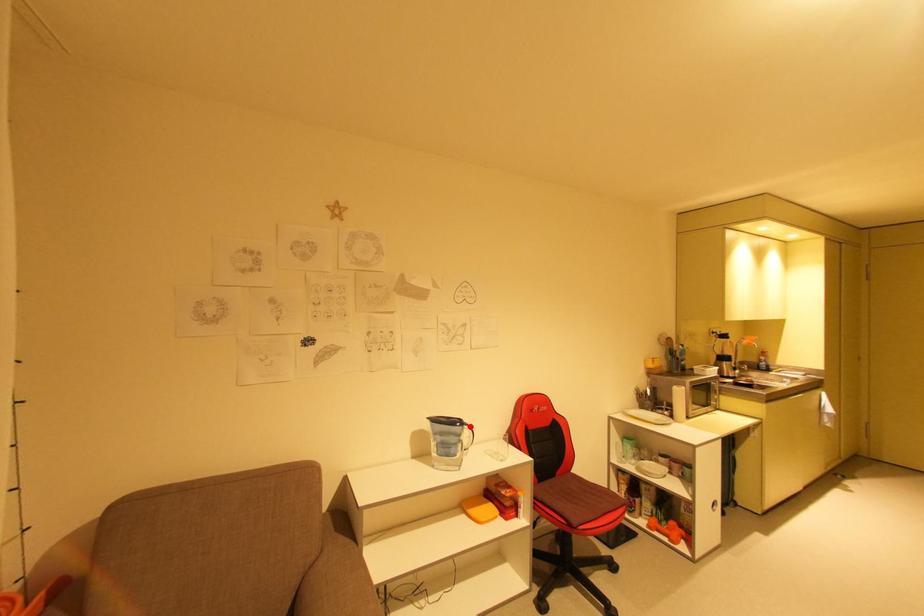
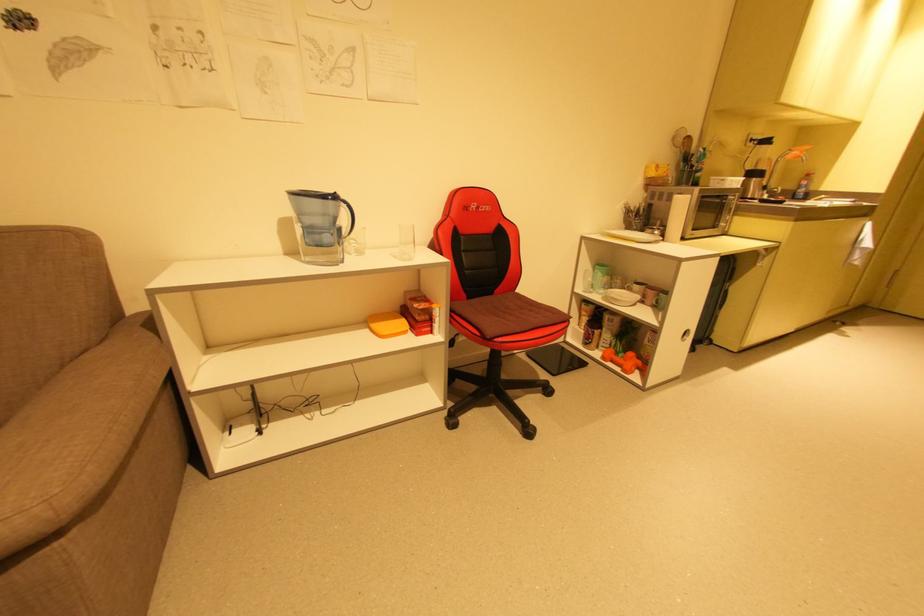
The point at the highlighted location is marked in the first image. Where is the corresponding point in the second image?

(346, 204)